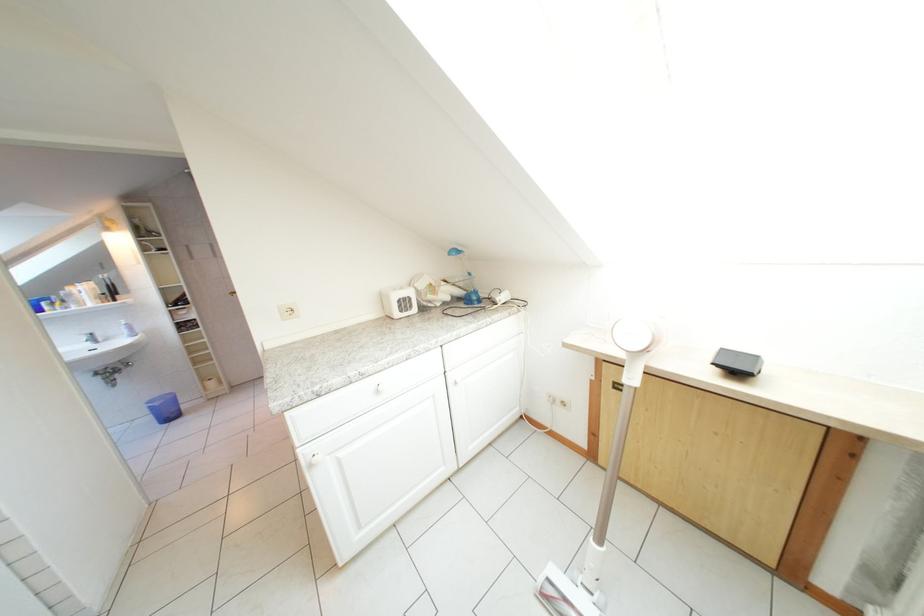
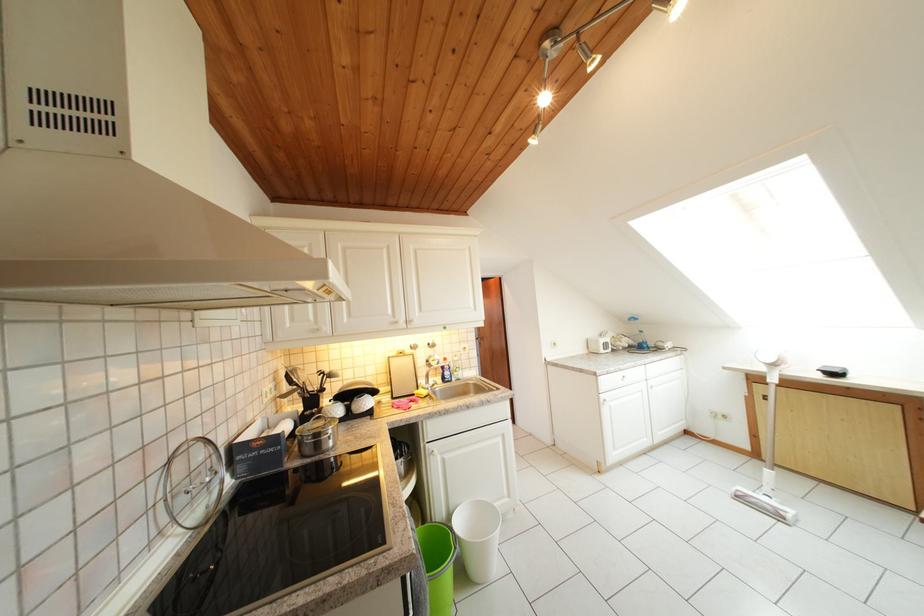
The point at (601, 461) is marked in the first image. Where is the corresponding point in the second image?

(764, 460)